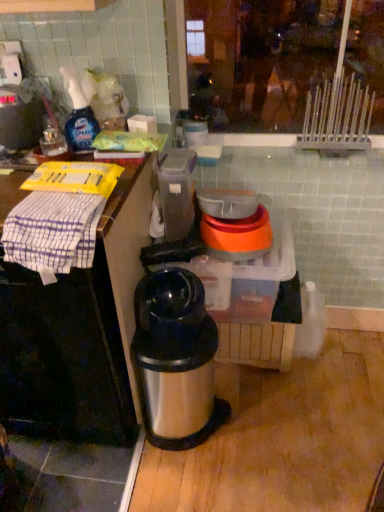
Where is `empty space that is ontop of white checkered cloth at left (from a real-world perspective)`? The image size is (384, 512). empty space that is ontop of white checkered cloth at left (from a real-world perspective) is located at coordinates (54, 208).